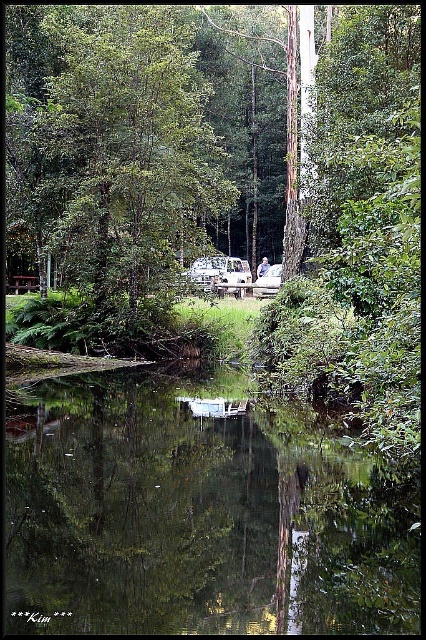
You are planning to take a photo of the green leafy tree at center and the white plastic camper van at center from a position where both are visible. Based on their sizes, which object should you position closer to the camera to ensure both appear balanced in the frame?

To balance the frame, position the white plastic camper van at center closer to the camera since it is smaller than the green leafy tree at center. This will make both objects appear similar in size in the photo.

You are planning to take a photo of the green reflective water at center and the white plastic camper van at center from a position where both are visible. Which object will appear closer to the camera in the photo?

The white plastic camper van at center will appear closer to the camera because it is taller than the green reflective water at center.